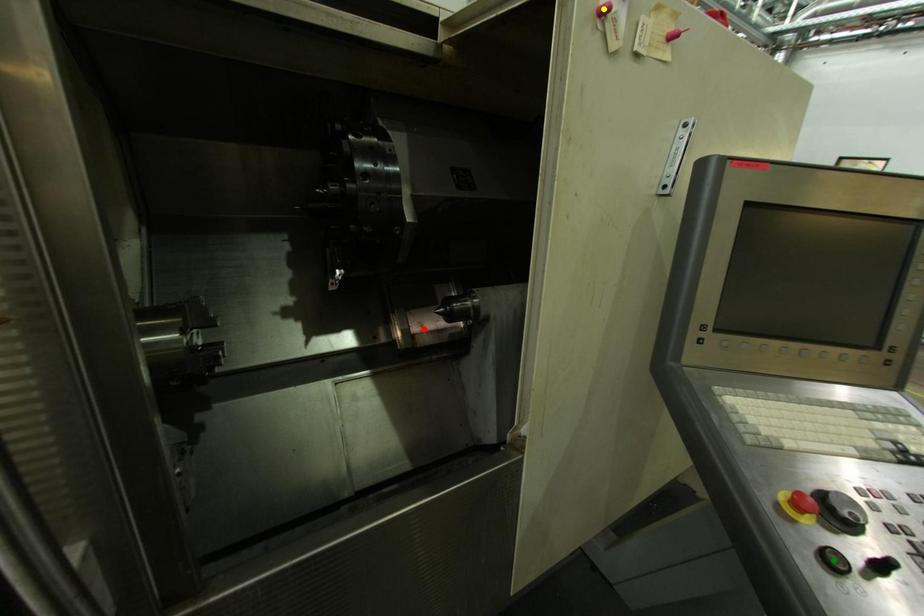
In the scene shown: Order these from nearest to farthest:
A) yellow point
B) green point
C) red point

green point, yellow point, red point